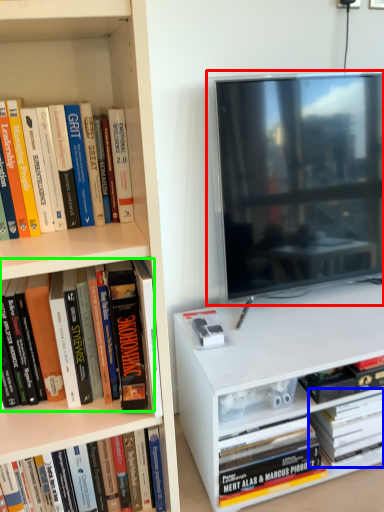
Question: Estimate the real-world distances between objects in this image. Which object is closer to television (highlighted by a red box), book (highlighted by a blue box) or book (highlighted by a green box)?

Choices:
 (A) book
 (B) book

Answer: (A)